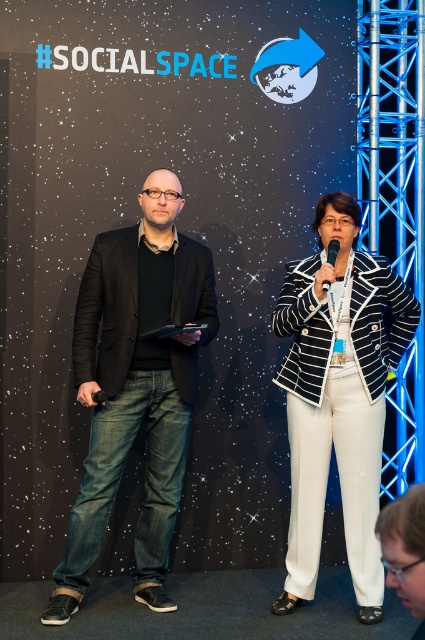
How far apart are black plastic microphone at center and black matte microphone at center?

black plastic microphone at center is 3.70 feet away from black matte microphone at center.

Which is behind, point (331, 264) or point (104, 396)?

The point (104, 396) is more distant.

Between point (336, 257) and point (105, 394), which one is positioned in front?

Point (336, 257)

Find the location of a particular element. The height and width of the screenshot is (640, 425). black plastic microphone at center is located at coordinates (333, 250).

From the picture: Is black and white striped blazer at center wider than black plastic microphone at center?

Yes.

Find the location of a particular element. This screenshot has width=425, height=640. black and white striped blazer at center is located at coordinates (339, 396).

Which is behind, point (314, 484) or point (337, 244)?

Point (314, 484)

This screenshot has height=640, width=425. Find the location of `black and white striped blazer at center`. black and white striped blazer at center is located at coordinates (339, 396).

Is point (388, 292) farther from camera compared to point (104, 396)?

That is True.

Between point (317, 467) and point (93, 392), which one is positioned in front?

Point (93, 392) is more forward.

Where is `black and white striped blazer at center`? The height and width of the screenshot is (640, 425). black and white striped blazer at center is located at coordinates (339, 396).